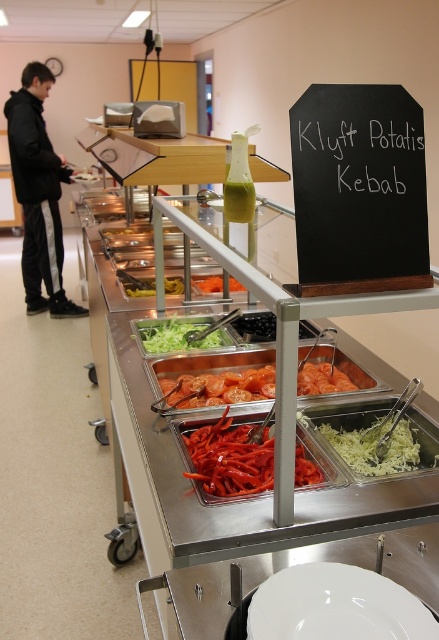
You are standing at the buffet station and want to grab the small bottle with green liquid. The bottle is located at point (295, 180). If you can reach up to 3 feet, can you reach it?

The point (295, 180) is 3.33 feet away from the camera, which is slightly beyond your reach of 3 feet. You might need to take a small step forward to grab it.

You are standing at the buffet station and want to reach the point marked at coordinates point [316,624]. If your arm can extend 70 centimeters, can you reach it?

The distance between you and the point [316,624] is 80.11 centimeters. Since your arm can only extend 70 centimeters, you cannot reach it.